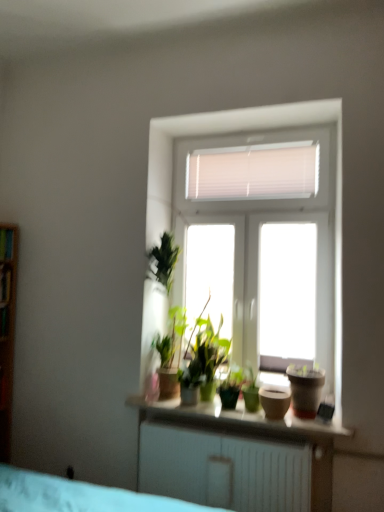
Image resolution: width=384 pixels, height=512 pixels. Identify the location of blank space situated above matte brown pot at center, arranged as the second flowerpot when viewed from the right (from a real-world perspective). (278, 388).